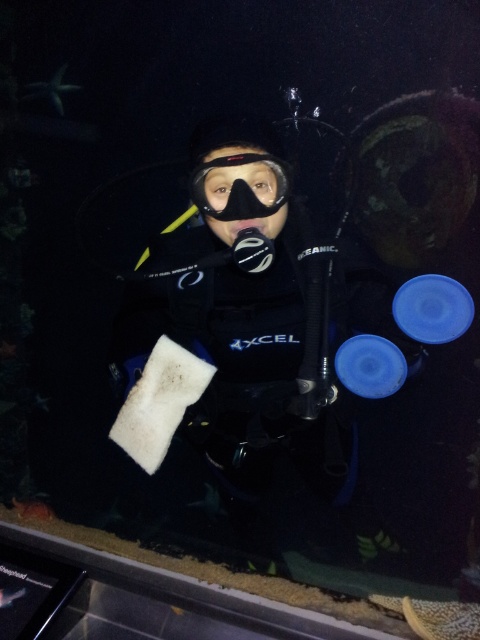
Between black matte wetsuit at center and black matte snorkel mask at center, which one has more height?

With more height is black matte wetsuit at center.

Does black matte wetsuit at center appear over black matte snorkel mask at center?

Actually, black matte wetsuit at center is below black matte snorkel mask at center.

Where is `black matte wetsuit at center`? black matte wetsuit at center is located at coordinates (237, 339).